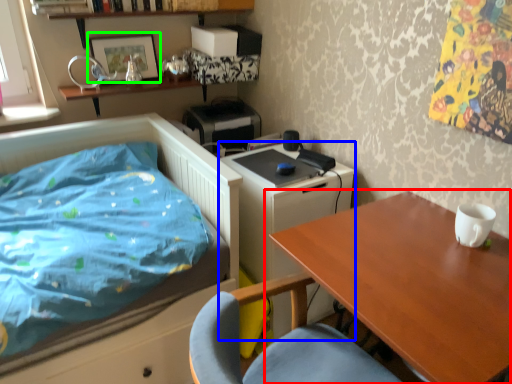
Question: Which object is the farthest from table (highlighted by a red box)? Choose among these: changing table (highlighted by a blue box) or picture frame (highlighted by a green box).

Choices:
 (A) changing table
 (B) picture frame

Answer: (B)